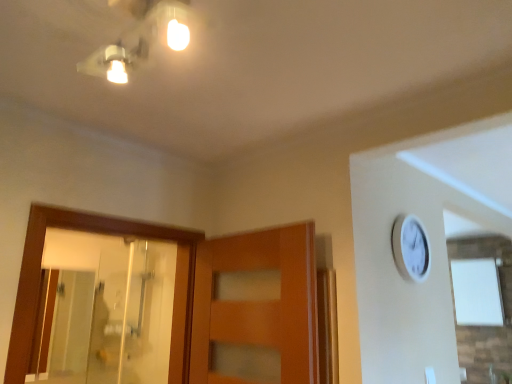
This screenshot has width=512, height=384. Describe the element at coordinates (108, 309) in the screenshot. I see `transparent glass mirror at left` at that location.

At what (x,y) coordinates should I click in order to perform the action: click on transparent glass mirror at left. Please return your answer as a coordinate pair (x, y). The width and height of the screenshot is (512, 384). Looking at the image, I should click on (108, 309).

What is the approximate width of transparent glass mirror at left?

18.08 centimeters.

What do you see at coordinates (141, 36) in the screenshot? I see `matte white light fixture at upper center` at bounding box center [141, 36].

Image resolution: width=512 pixels, height=384 pixels. What are the coordinates of `matte white light fixture at upper center` in the screenshot? It's located at (141, 36).

What is the approximate height of matte white light fixture at upper center?

The height of matte white light fixture at upper center is 21.55 centimeters.

Find the location of a particular element. transparent glass mirror at left is located at coordinates (108, 309).

Considering the positions of objects matte white light fixture at upper center and transparent glass mirror at left in the image provided, who is more to the right, matte white light fixture at upper center or transparent glass mirror at left?

matte white light fixture at upper center.

In the scene shown: Does matte white light fixture at upper center come in front of transparent glass mirror at left?

Yes.

Is point (178, 21) closer to camera compared to point (119, 296)?

That is True.

From the picture: From the image's perspective, is matte white light fixture at upper center located above or below transparent glass mirror at left?

matte white light fixture at upper center is above transparent glass mirror at left.

From a real-world perspective, is matte white light fixture at upper center above or below transparent glass mirror at left?

Clearly, from a real-world perspective, matte white light fixture at upper center is above transparent glass mirror at left.

Can you confirm if matte white light fixture at upper center is thinner than transparent glass mirror at left?

Incorrect, the width of matte white light fixture at upper center is not less than that of transparent glass mirror at left.

Considering the relative sizes of matte white light fixture at upper center and transparent glass mirror at left in the image provided, is matte white light fixture at upper center shorter than transparent glass mirror at left?

Yes, matte white light fixture at upper center is shorter than transparent glass mirror at left.

Based on the photo, can you confirm if matte white light fixture at upper center is bigger than transparent glass mirror at left?

No, matte white light fixture at upper center is not bigger than transparent glass mirror at left.

Do you think matte white light fixture at upper center is within transparent glass mirror at left, or outside of it?

matte white light fixture at upper center is not inside transparent glass mirror at left, it's outside.

Is matte white light fixture at upper center positioned far away from transparent glass mirror at left?

Yes.

Is matte white light fixture at upper center facing towards transparent glass mirror at left?

No, matte white light fixture at upper center is not turned towards transparent glass mirror at left.

You are a GUI agent. You are given a task and a screenshot of the screen. Output one action in this format:
    pyautogui.click(x=<x>, y=<y>)
    Task: Click on the mirror on the left of matte white light fixture at upper center
    The height and width of the screenshot is (384, 512).
    Given the screenshot: What is the action you would take?
    pyautogui.click(x=108, y=309)

Which object is positioned more to the right, transparent glass mirror at left or matte white light fixture at upper center?

matte white light fixture at upper center is more to the right.

Which object is further away from the camera taking this photo, transparent glass mirror at left or matte white light fixture at upper center?

transparent glass mirror at left is behind.

Is point (85, 244) positioned after point (181, 5)?

Yes, it is.

From the image's perspective, which one is positioned higher, transparent glass mirror at left or matte white light fixture at upper center?

matte white light fixture at upper center appears higher in the image.

From a real-world perspective, is transparent glass mirror at left physically located above or below matte white light fixture at upper center?

From a real-world perspective, transparent glass mirror at left is physically below matte white light fixture at upper center.

Which of these two, transparent glass mirror at left or matte white light fixture at upper center, is thinner?

With smaller width is transparent glass mirror at left.

Can you confirm if transparent glass mirror at left is taller than matte white light fixture at upper center?

Indeed, transparent glass mirror at left has a greater height compared to matte white light fixture at upper center.

Looking at this image, between transparent glass mirror at left and matte white light fixture at upper center, which one has larger size?

With larger size is transparent glass mirror at left.

Can we say transparent glass mirror at left lies outside matte white light fixture at upper center?

Absolutely, transparent glass mirror at left is external to matte white light fixture at upper center.

Is there a large distance between transparent glass mirror at left and matte white light fixture at upper center?

Yes, transparent glass mirror at left and matte white light fixture at upper center are quite far apart.

Is transparent glass mirror at left turned away from matte white light fixture at upper center?

transparent glass mirror at left is not turned away from matte white light fixture at upper center.

Identify the location of light fixture that is in front of the transparent glass mirror at left. coord(141,36).

Where is `mirror on the left of matte white light fixture at upper center`? mirror on the left of matte white light fixture at upper center is located at coordinates pos(108,309).

At what (x,y) coordinates should I click in order to perform the action: click on light fixture in front of the transparent glass mirror at left. Please return your answer as a coordinate pair (x, y). Looking at the image, I should click on (141, 36).